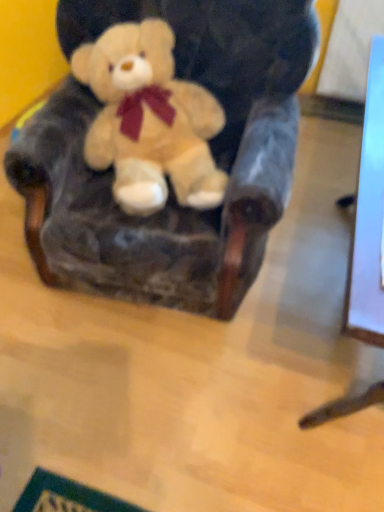
Identify the location of free space in front of velvet plush bear at center. Image resolution: width=384 pixels, height=512 pixels. (145, 398).